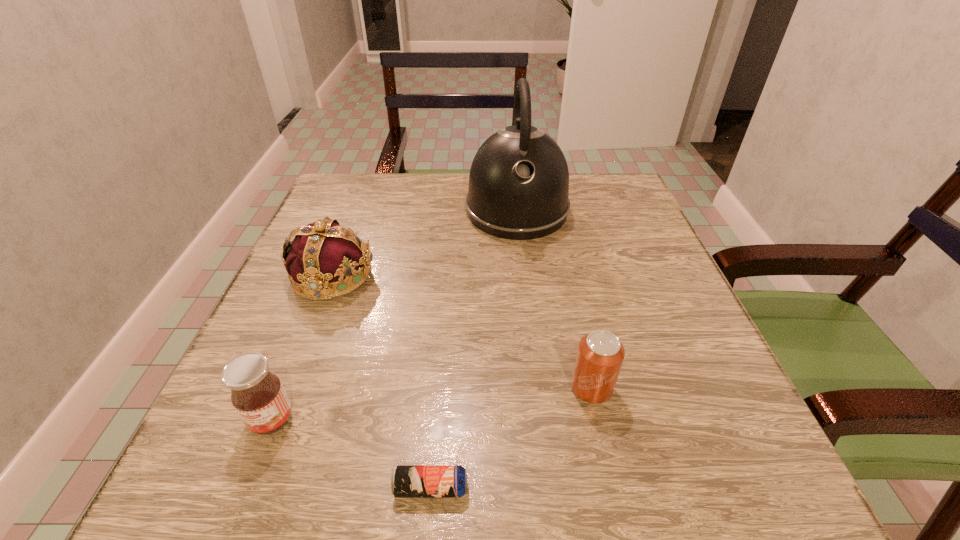
Image resolution: width=960 pixels, height=540 pixels. I want to click on the farthest object, so click(x=518, y=189).

Where is `kettle`? kettle is located at coordinates (518, 189).

The width and height of the screenshot is (960, 540). Identify the location of crown. (323, 253).

At what (x,y) coordinates should I click in order to perform the action: click on jam. Please return your answer as a coordinate pair (x, y). The width and height of the screenshot is (960, 540). Looking at the image, I should click on (257, 394).

Find the location of `can`. can is located at coordinates (600, 355).

Where is `the shortest object`? the shortest object is located at coordinates (408, 481).

Locate an element on the screen. The width and height of the screenshot is (960, 540). the nearest object is located at coordinates (408, 481).

You are a GUI agent. You are given a task and a screenshot of the screen. Output one action in this format:
    pyautogui.click(x=<x>, y=<y>)
    Task: Click on the vacant space located on the spout of the tallest object
    
    Given the screenshot: What is the action you would take?
    pyautogui.click(x=533, y=348)

You are a GUI agent. You are given a task and a screenshot of the screen. Output one action in this format:
    pyautogui.click(x=<x>, y=<y>)
    Task: Click on the blank space located on the right of the second farthest object
    The width and height of the screenshot is (960, 540).
    Given the screenshot: What is the action you would take?
    pyautogui.click(x=455, y=275)

This screenshot has width=960, height=540. I want to click on vacant space situated on the label side of the jam, so click(244, 490).